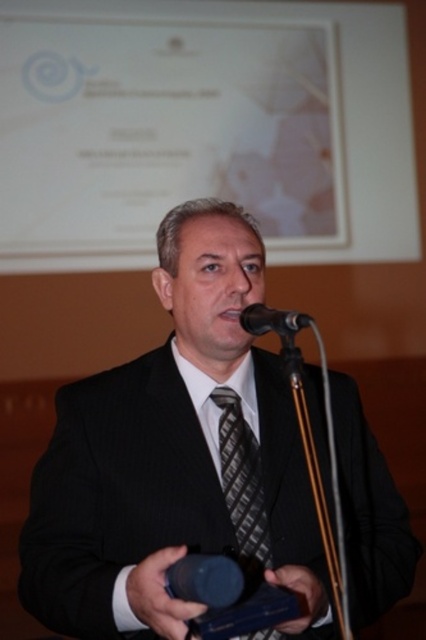
Question: Which point is closer to the camera taking this photo?

Choices:
 (A) (236, 419)
 (B) (204, 598)

Answer: (B)

Question: Which object is closer to the camera taking this photo?

Choices:
 (A) black matte microphone at center
 (B) black metallic microphone at center
 (C) black textured tie at center

Answer: (A)

Question: Estimate the real-world distances between objects in this image. Which object is closer to the black metallic microphone at center?

Choices:
 (A) black textured tie at center
 (B) black pinstripe suit at center
 (C) black matte microphone at center

Answer: (A)

Question: In this image, where is black textured tie at center located relative to black matte microphone at center?

Choices:
 (A) right
 (B) left

Answer: (A)

Question: Is black pinstripe suit at center above black textured tie at center?

Choices:
 (A) yes
 (B) no

Answer: (A)

Question: Is black matte microphone at center bigger than black metallic microphone at center?

Choices:
 (A) yes
 (B) no

Answer: (B)